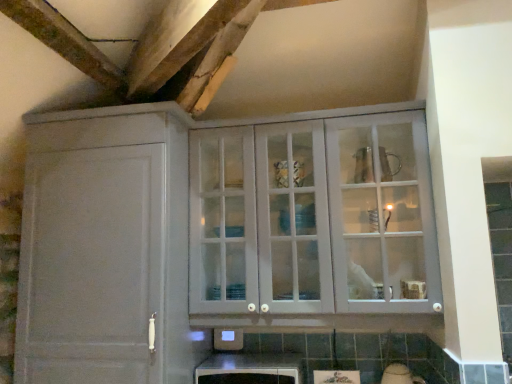
Question: Does point (223, 365) appear closer or farther from the camera than point (291, 311)?

Choices:
 (A) farther
 (B) closer

Answer: (A)

Question: In terms of size, does white glossy microwave at lower center, arranged as the 2th cabinetry when viewed from the left, appear bigger or smaller than white glass cabinet at upper center?

Choices:
 (A) big
 (B) small

Answer: (B)

Question: Considering the real-world distances, which object is farthest from the white glossy microwave at lower center, arranged as the 2th cabinetry when viewed from the left?

Choices:
 (A) matte gray cabinet at upper center, the first cabinetry viewed from the left
 (B) white glass cabinet at upper center

Answer: (B)

Question: Estimate the real-world distances between objects in this image. Which object is closer to the white glass cabinet at upper center?

Choices:
 (A) matte gray cabinet at upper center, the first cabinetry viewed from the left
 (B) white glossy microwave at lower center, arranged as the 2th cabinetry when viewed from the left

Answer: (A)